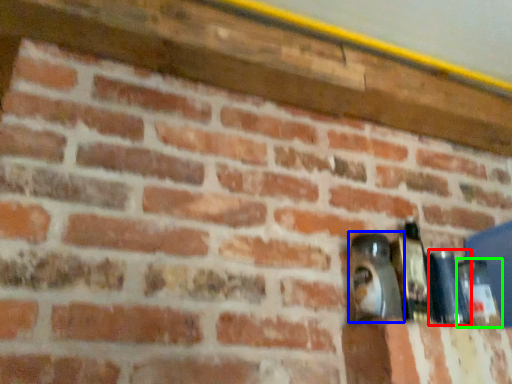
Question: Estimate the real-world distances between objects in this image. Which object is farther from bottle (highlighted by a red box), bottle (highlighted by a blue box) or bottle (highlighted by a green box)?

Choices:
 (A) bottle
 (B) bottle

Answer: (A)